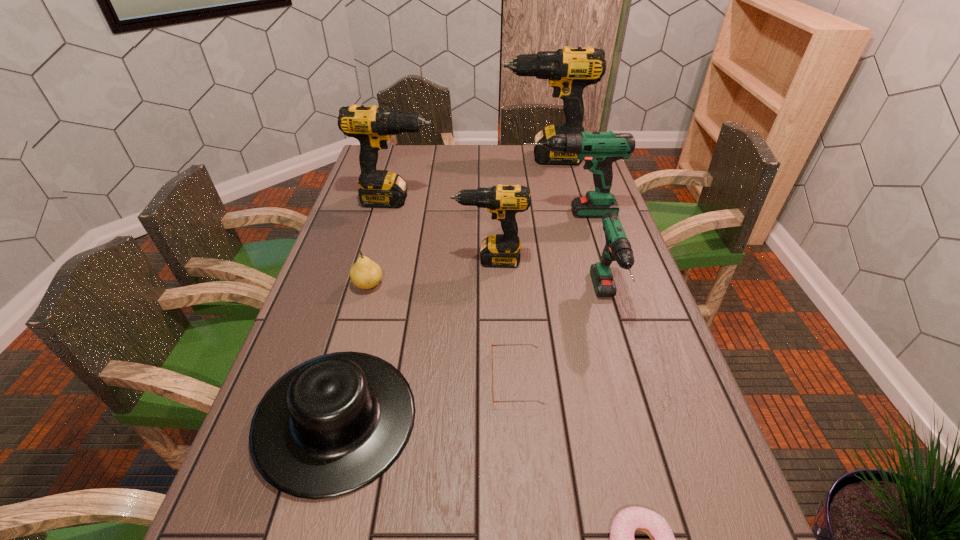
Find the location of a particular element. The image size is (960, 540). dress hat situated at the left edge is located at coordinates (332, 425).

The image size is (960, 540). What are the coordinates of `pear that is at the left edge` in the screenshot? It's located at coord(365,274).

This screenshot has width=960, height=540. Find the location of `object present at the far right corner`. object present at the far right corner is located at coordinates (569, 70).

This screenshot has width=960, height=540. What are the coordinates of `free region at the far edge of the desktop` in the screenshot? It's located at (502, 159).

Identify the location of vacant space at the left edge of the desktop. (364, 247).

Where is `vacant space at the right edge`? Image resolution: width=960 pixels, height=540 pixels. vacant space at the right edge is located at coordinates (618, 305).

At what (x,y) coordinates should I click in order to perform the action: click on free space at the far left corner of the desktop. Please return your answer as a coordinate pair (x, y). Image resolution: width=960 pixels, height=540 pixels. Looking at the image, I should click on (399, 146).

The width and height of the screenshot is (960, 540). Identify the location of vacant space at the far right corner of the desktop. (587, 171).

The height and width of the screenshot is (540, 960). Find the location of `blank region between the bigger green drill and the sunglasses`. blank region between the bigger green drill and the sunglasses is located at coordinates (542, 295).

The image size is (960, 540). In order to click on free spot between the farther green drill and the pear in this screenshot , I will do `click(468, 249)`.